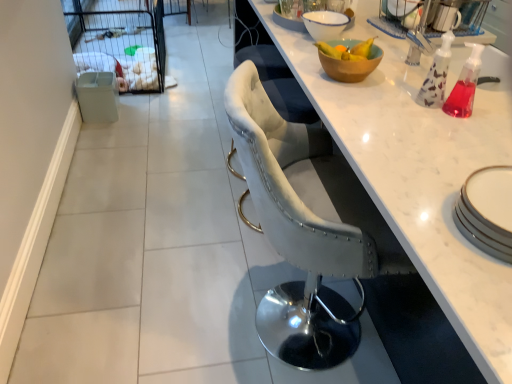
Question: Would you say velvet grey chair at center is to the left or to the right of white mesh screen door at upper left in the picture?

Choices:
 (A) left
 (B) right

Answer: (B)

Question: Do you think velvet grey chair at center is within white mesh screen door at upper left, or outside of it?

Choices:
 (A) inside
 (B) outside

Answer: (B)

Question: Based on their relative distances, which object is farther from the white ceramic bowl at upper center, which is the 1th bowl in back-to-front order?

Choices:
 (A) white mesh screen door at upper left
 (B) velvet grey chair at center
 (C) white marble countertop at center
 (D) wooden bowl at upper right, the 1th bowl positioned from the front

Answer: (A)

Question: Which is farther from the white marble countertop at center?

Choices:
 (A) white ceramic bowl at upper center, which is the 1th bowl in back-to-front order
 (B) white mesh screen door at upper left
 (C) wooden bowl at upper right, the 1th bowl positioned from the front
 (D) velvet grey chair at center

Answer: (B)